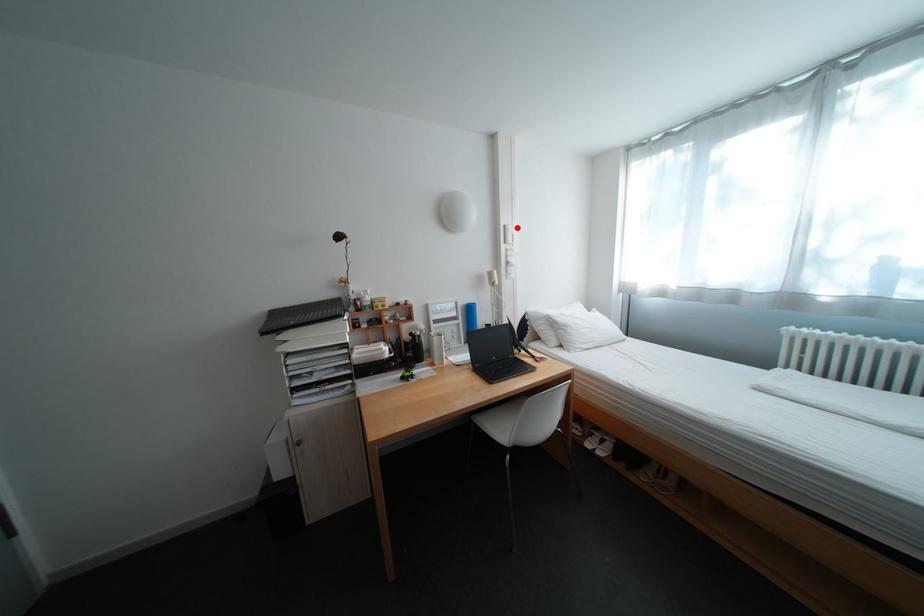
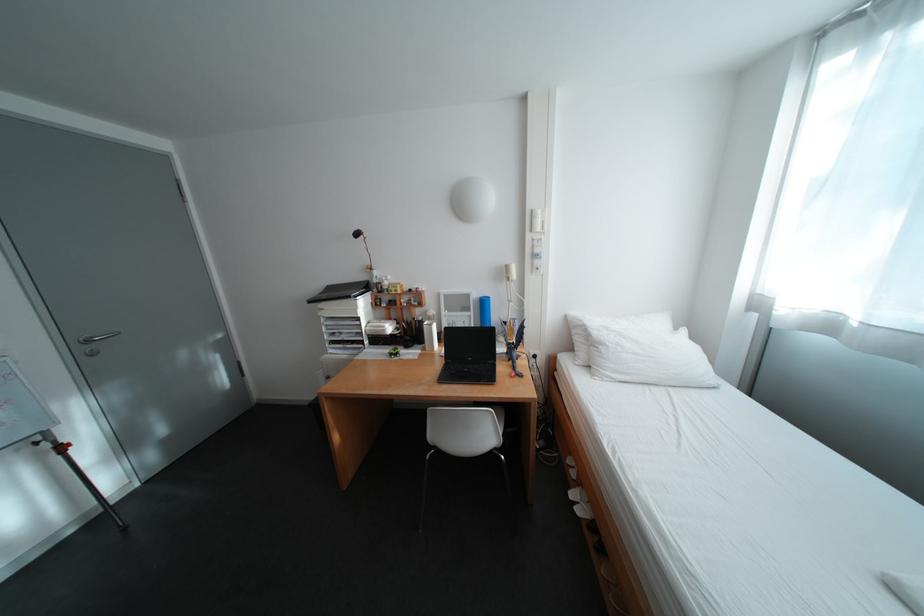
Locate, in the second image, the point that corresponds to the highlighted location in the first image.

(544, 213)